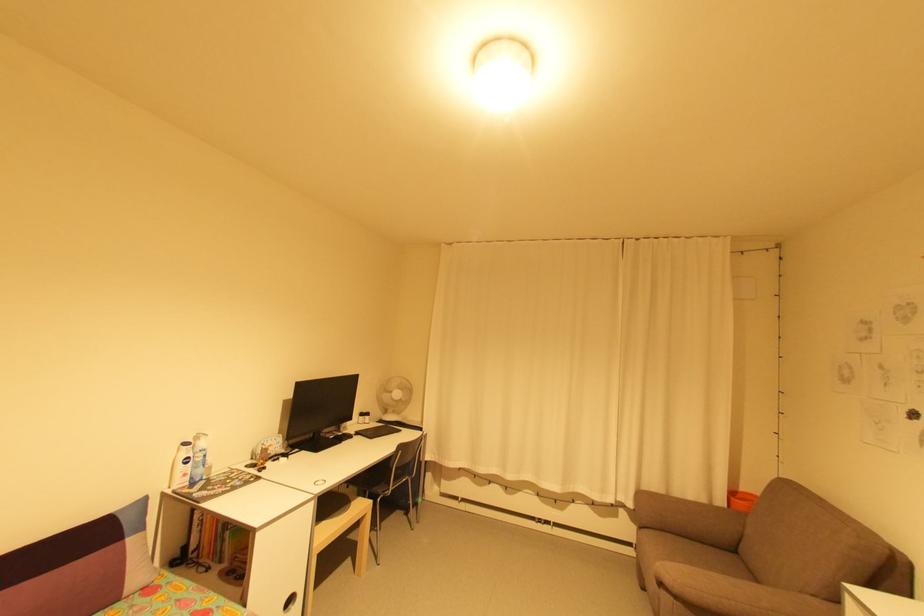
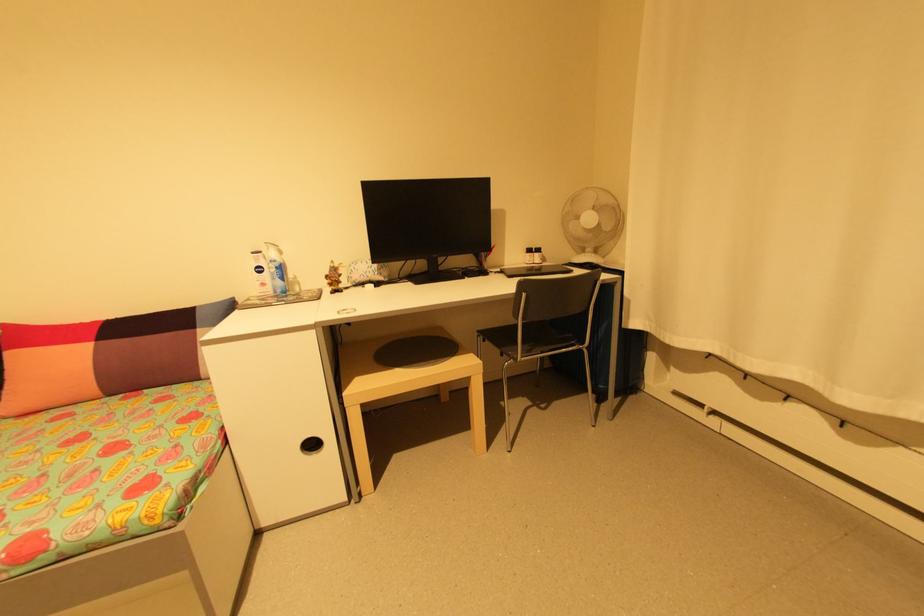
Find the pixel in the second image that matches [371,418] in the first image.

(541, 254)